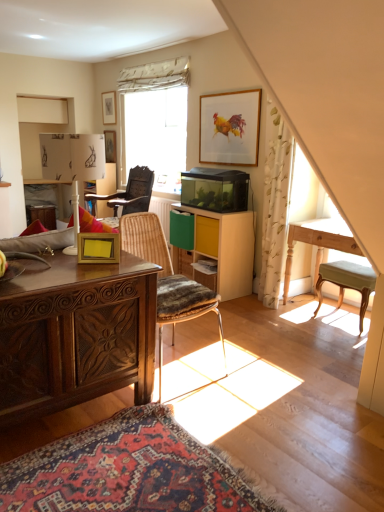
You are a GUI agent. You are given a task and a screenshot of the screen. Output one action in this format:
    pyautogui.click(x=<x>, y=<y>)
    Task: Click on the free space between light wood table at right and rustic wood chair at center, the second chair positioned from the right
    This screenshot has width=384, height=512.
    Given the screenshot: What is the action you would take?
    pyautogui.click(x=282, y=338)